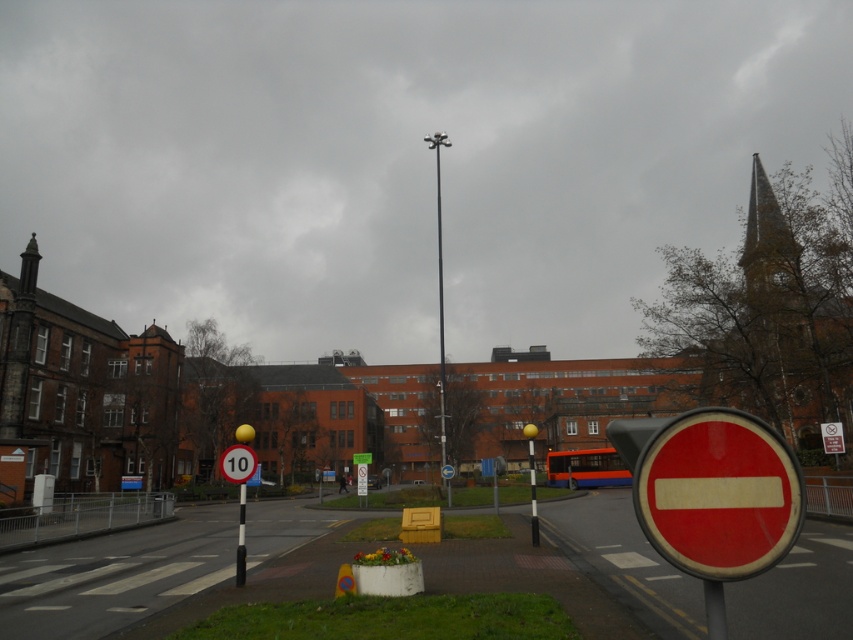
Question: Considering the relative positions of orange metallic bus at center and metallic speed limit sign at left in the image provided, where is orange metallic bus at center located with respect to metallic speed limit sign at left?

Choices:
 (A) right
 (B) left

Answer: (A)

Question: Which object appears farthest from the camera in this image?

Choices:
 (A) metallic pole at center
 (B) orange metallic bus at center
 (C) red plastic sign at center
 (D) black metal pole at center

Answer: (B)

Question: Does metallic pole at center appear on the right side of black metal pole at center?

Choices:
 (A) no
 (B) yes

Answer: (B)

Question: Among these objects, which one is nearest to the camera?

Choices:
 (A) metallic speed limit sign at left
 (B) orange metallic bus at center
 (C) black metal pole at center
 (D) red plastic sign at center

Answer: (C)

Question: Estimate the real-world distances between objects in this image. Which object is farther from the black metal pole at center?

Choices:
 (A) metallic speed limit sign at left
 (B) red plastic sign at center
 (C) metallic pole at center
 (D) orange metallic bus at center

Answer: (C)

Question: Can you confirm if orange metallic bus at center is smaller than red plastic sign at center?

Choices:
 (A) yes
 (B) no

Answer: (B)